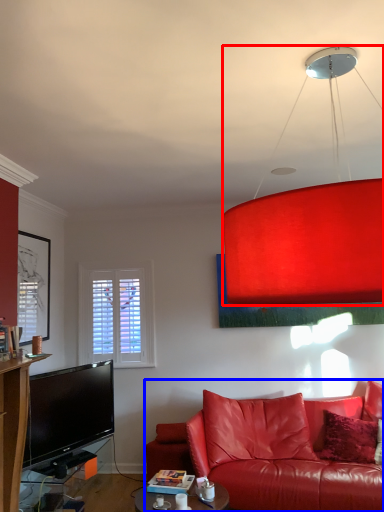
Question: Which point is further to the camera, lamp (highlighted by a red box) or studio couch (highlighted by a blue box)?

Choices:
 (A) lamp
 (B) studio couch

Answer: (B)